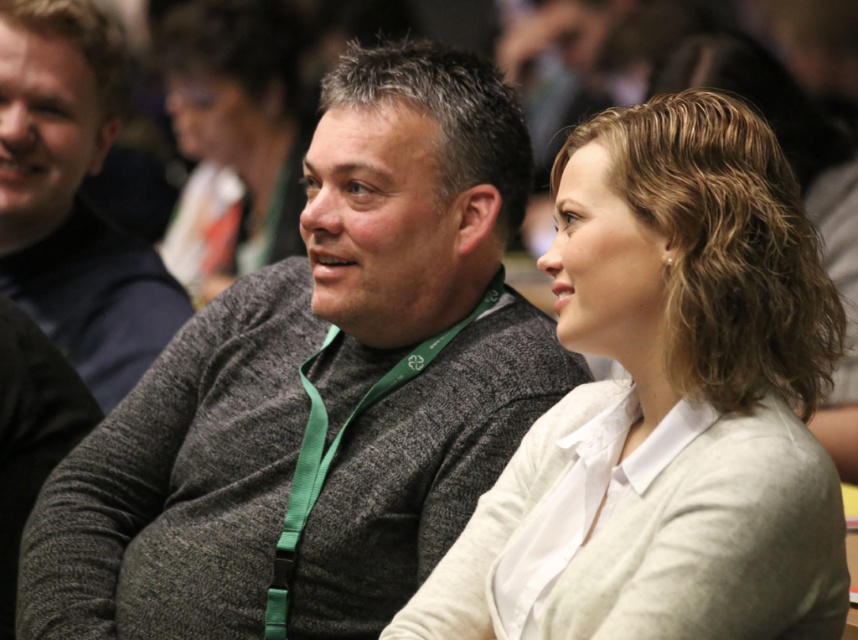
Consider the image. You are a photographer at the event and want to ensure both the gray knit sweater at center and the matte black hair at upper center are clearly visible in your photo. Which object should you focus on to ensure it is in frame first, considering their sizes?

The gray knit sweater at center is not as tall as matte black hair at upper center, so you should focus on the matte black hair at upper center first to ensure it is fully in frame.

You are organizing a clothing donation drive and need to determine which sweater can fit into a standard donation box that accommodates items up to 30 inches in width. Given the light beige sweater at center and the dark gray sweater at center, which one would you recommend placing in the box?

The light beige sweater at center has a larger width than the dark gray sweater at center. Since the light beige sweater is wider, it might exceed the 30 inch limit. Therefore, the dark gray sweater at center would be more likely to fit into the donation box.